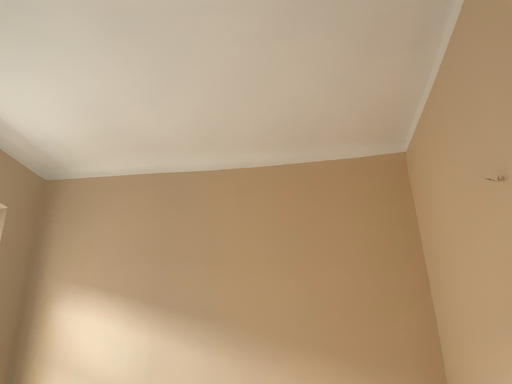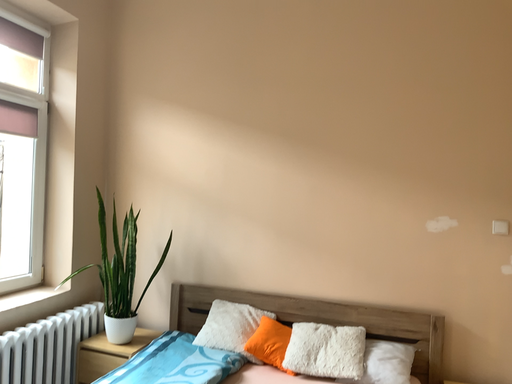
Question: How did the camera likely rotate when shooting the video?

Choices:
 (A) rotated left
 (B) rotated right

Answer: (A)